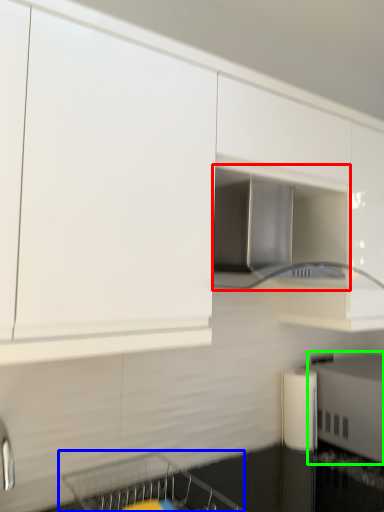
Question: Based on their relative distances, which object is farther from home appliance (highlighted by a red box)? Choose from dish washer (highlighted by a blue box) and appliance (highlighted by a green box).

Choices:
 (A) dish washer
 (B) appliance

Answer: (A)